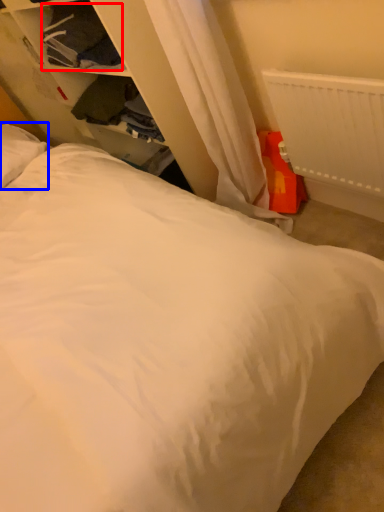
Question: Among these objects, which one is farthest to the camera, clothing (highlighted by a red box) or pillow (highlighted by a blue box)?

Choices:
 (A) clothing
 (B) pillow

Answer: (B)